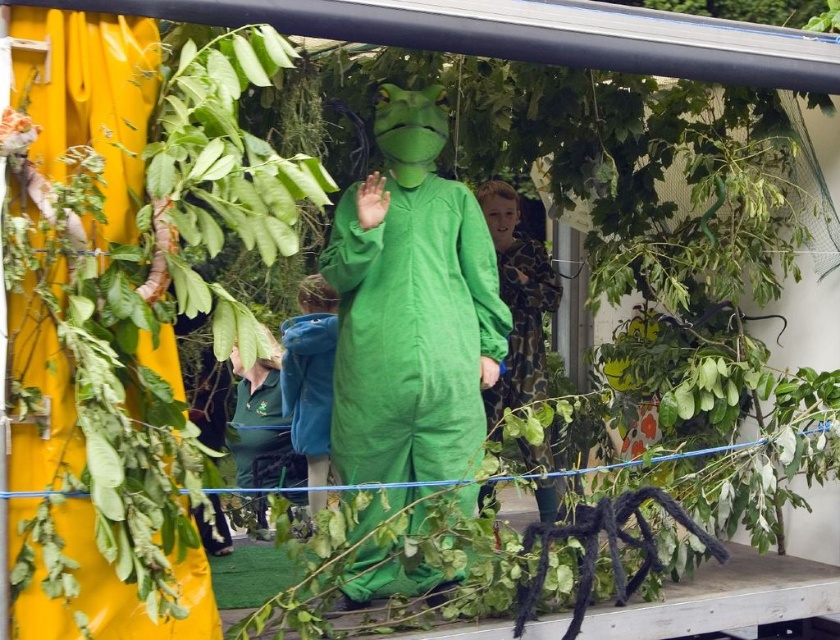
Question: Among these objects, which one is nearest to the camera?

Choices:
 (A) blue velvet jacket at center
 (B) green fabric bag at lower left

Answer: (B)

Question: Does green matte costume at center appear under camouflage fabric at center?

Choices:
 (A) yes
 (B) no

Answer: (A)

Question: Which object is positioned farthest from the blue velvet jacket at center?

Choices:
 (A) black fuzzy spider at lower right
 (B) green fabric bag at lower left

Answer: (A)

Question: Is green matte costume at center below black fuzzy spider at lower right?

Choices:
 (A) no
 (B) yes

Answer: (A)

Question: Which point is closer to the camera?

Choices:
 (A) green fabric bag at lower left
 (B) black fuzzy spider at lower right
 (C) camouflage fabric at center

Answer: (B)

Question: Can you confirm if camouflage fabric at center is thinner than black fuzzy spider at lower right?

Choices:
 (A) yes
 (B) no

Answer: (A)